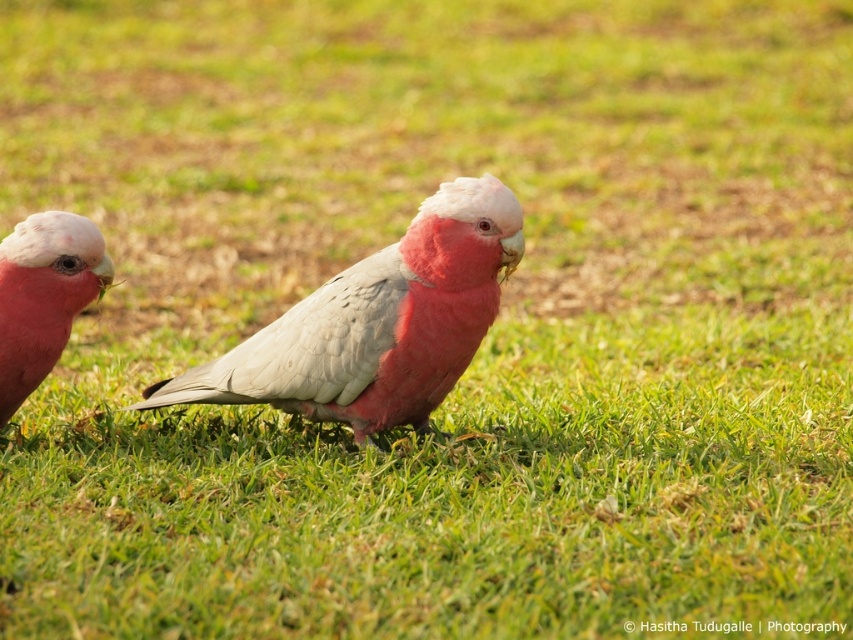
Which is more to the left, pink matte parrot at center or pink matte parrot at left?

From the viewer's perspective, pink matte parrot at left appears more on the left side.

Is pink matte parrot at center wider than pink matte parrot at left?

Indeed, pink matte parrot at center has a greater width compared to pink matte parrot at left.

Is point (265, 390) behind point (27, 369)?

No, it is not.

This screenshot has height=640, width=853. Identify the location of pink matte parrot at center. (376, 323).